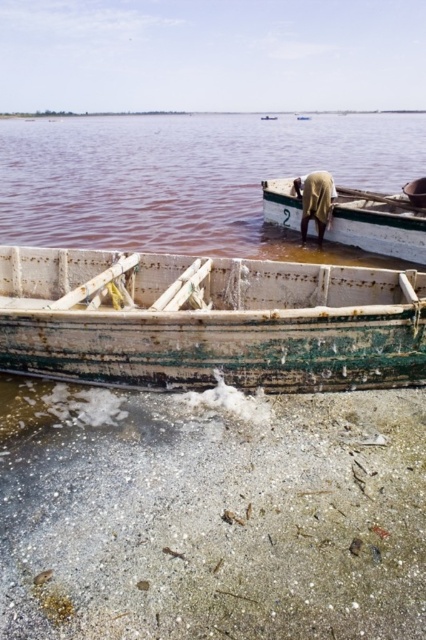
You are standing at the lakeside and want to place a large picnic basket on the ground. Which location would be more suitable between the white sandy shore at lower center and the brown fabric cloth at center? Explain your choice based on their sizes.

The white sandy shore at lower center is larger in size than the brown fabric cloth at center, so the picnic basket would fit better on the white sandy shore at lower center.